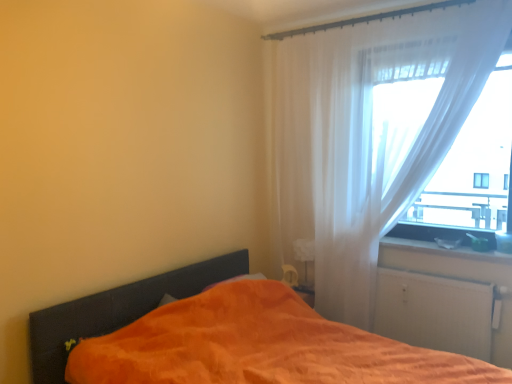
Where is `free spot above white glossy window sill at lower right (from a real-world perspective)`? free spot above white glossy window sill at lower right (from a real-world perspective) is located at coordinates (434, 243).